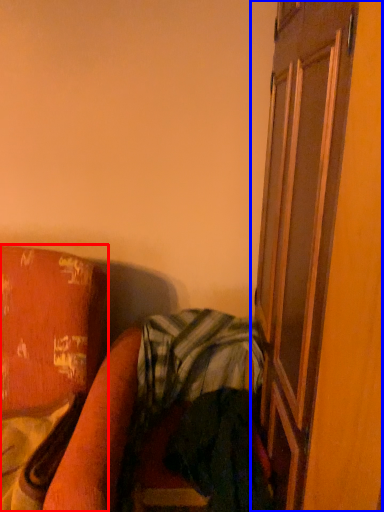
Question: Among these objects, which one is farthest to the camera, furniture (highlighted by a red box) or screen door (highlighted by a blue box)?

Choices:
 (A) furniture
 (B) screen door

Answer: (A)